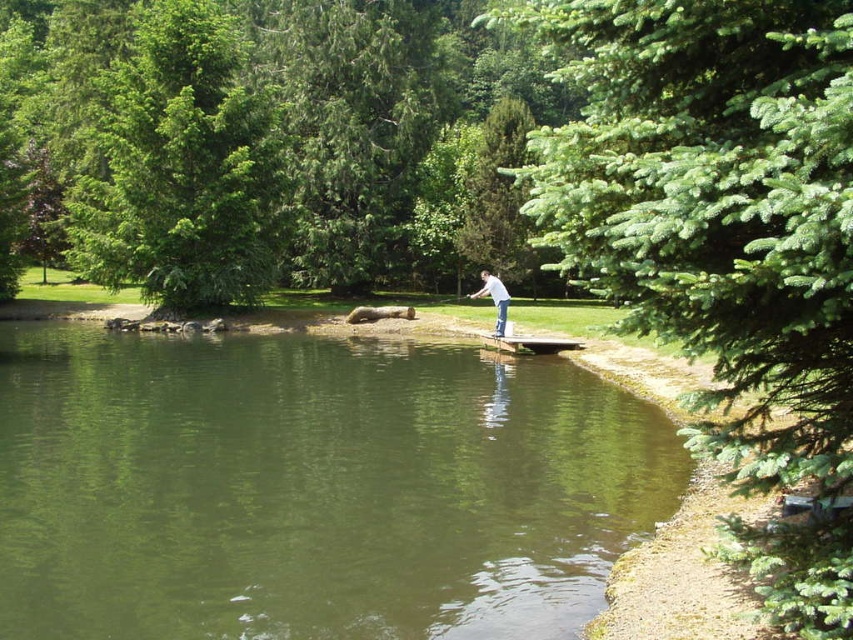
Which is more to the right, green leafy tree at left or white matte shirt at center?

white matte shirt at center is more to the right.

Is green leafy tree at left positioned behind white matte shirt at center?

That is True.

What do you see at coordinates (183, 168) in the screenshot?
I see `green leafy tree at left` at bounding box center [183, 168].

You are a GUI agent. You are given a task and a screenshot of the screen. Output one action in this format:
    pyautogui.click(x=<x>, y=<y>)
    Task: Click on the green leafy tree at left
    The width and height of the screenshot is (853, 640).
    Given the screenshot: What is the action you would take?
    pyautogui.click(x=183, y=168)

Who is positioned more to the left, green water at center or green leafy tree at left?

Positioned to the left is green leafy tree at left.

Can you confirm if green water at center is smaller than green leafy tree at left?

Yes, green water at center is smaller than green leafy tree at left.

What do you see at coordinates (312, 486) in the screenshot? I see `green water at center` at bounding box center [312, 486].

The image size is (853, 640). What are the coordinates of `green water at center` in the screenshot? It's located at (312, 486).

Between point (552, 620) and point (496, 310), which one is positioned in front?

Point (552, 620) is more forward.

Who is positioned more to the left, green water at center or white matte shirt at center?

green water at center

Between point (273, 344) and point (498, 282), which one is positioned in front?

Positioned in front is point (498, 282).

At what (x,y) coordinates should I click in order to perform the action: click on green water at center. Please return your answer as a coordinate pair (x, y). This screenshot has height=640, width=853. Looking at the image, I should click on (312, 486).